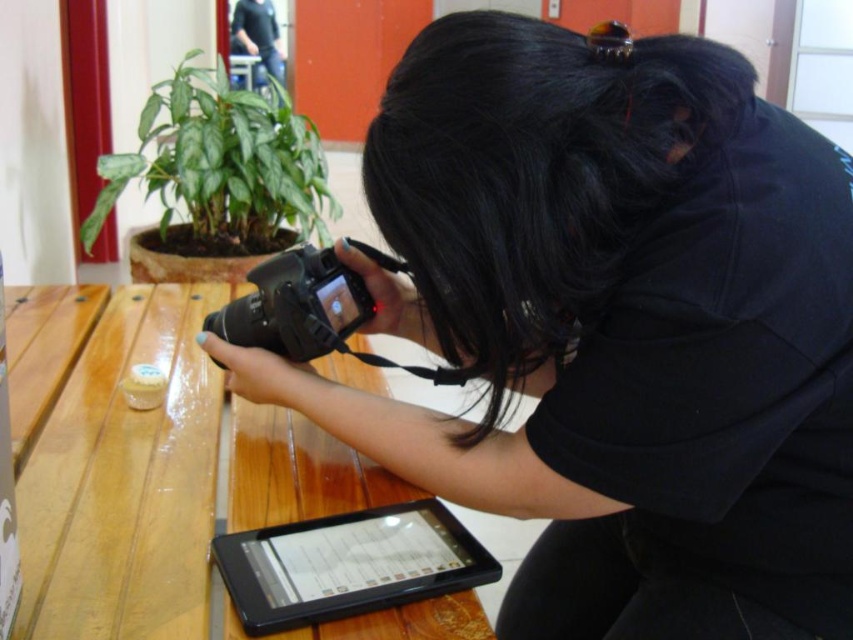
You are setting up a photo shoot and need to ensure that the green matte plant at upper left and the black plastic tablet at lower center are both in frame. Based on their sizes, which object might require more space horizontally to fit into the shot?

The green matte plant at upper left might be wider than the black plastic tablet at lower center, so it might require more horizontal space to ensure it fits into the shot.

You are setting up a photo shoot and need to ensure that the green matte plant at upper left and the black matte camera at center are positioned correctly. Based on their heights, which object should be placed lower to avoid blocking the camera lens?

The green matte plant at upper left is taller than the black matte camera at center, so to avoid blocking the camera lens, the green matte plant at upper left should be placed lower.